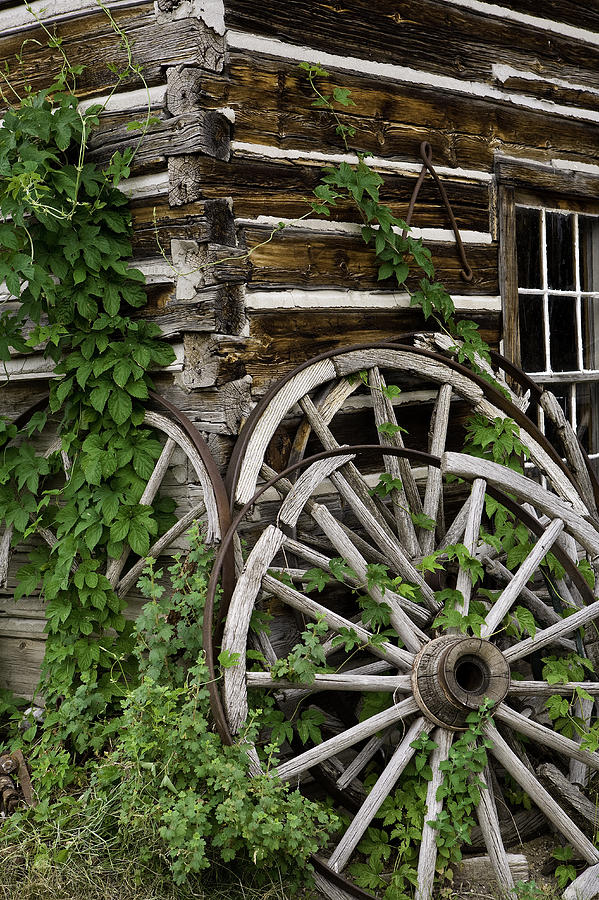
The image size is (599, 900). I want to click on plaster, so click(332, 300).